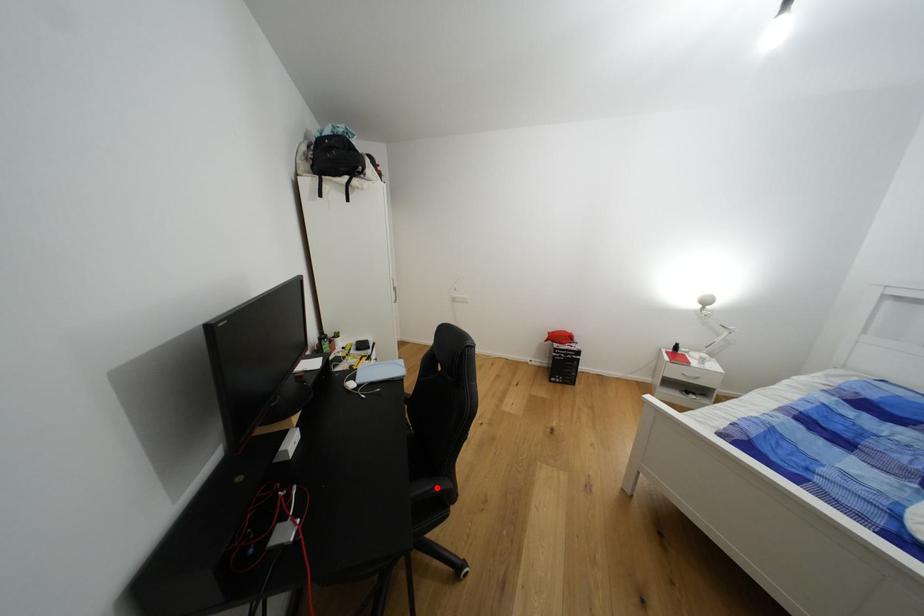
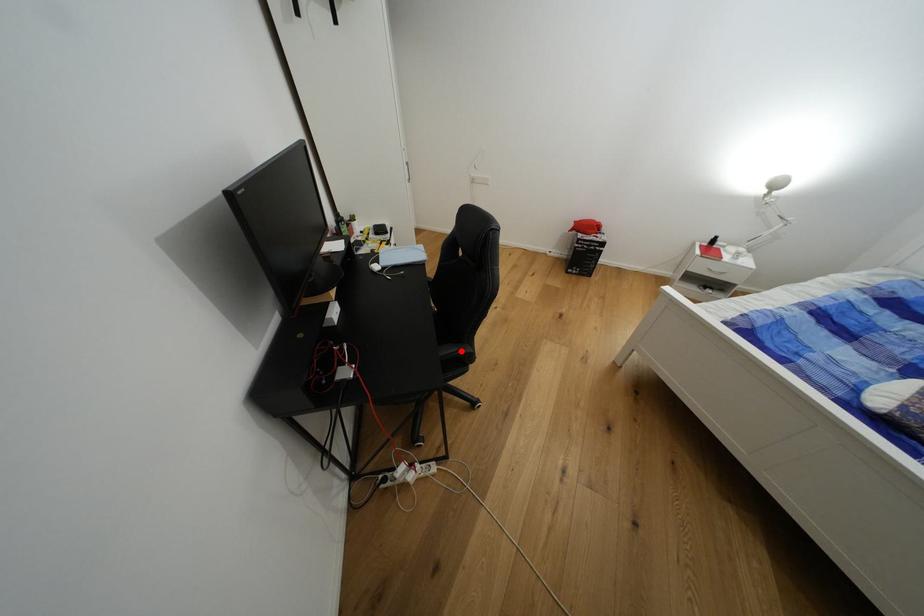
I am providing you with two images of the same scene from different viewpoints. A red point is marked on the first image and another point is marked on the second image. Do the highlighted points in image1 and image2 indicate the same real-world spot?

Yes